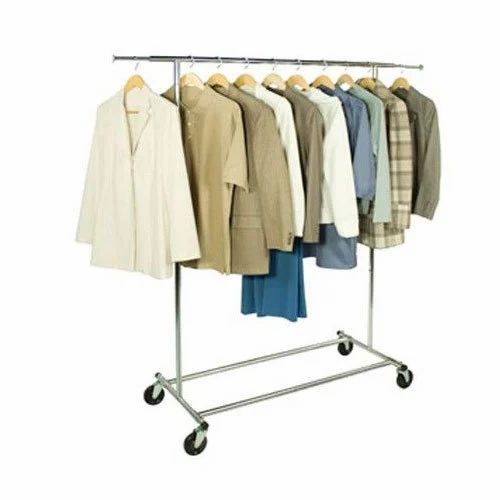
Where is `hangers`? The width and height of the screenshot is (500, 500). hangers is located at coordinates (140, 80), (196, 80), (223, 78), (242, 78), (274, 78), (299, 78), (326, 80), (341, 79), (369, 69), (401, 79).